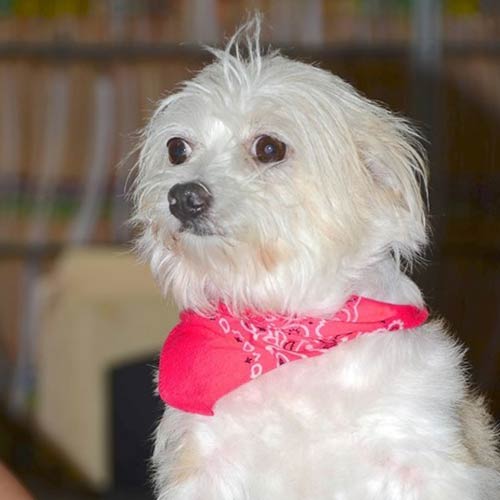
Locate an element on the screen. couch is located at coordinates (100, 347).